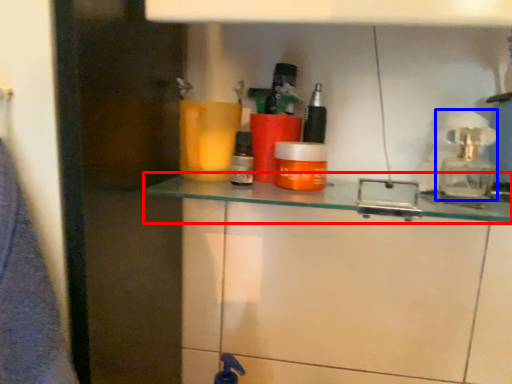
Question: Which point is further to the camera, shelf (highlighted by a red box) or soap dispenser (highlighted by a blue box)?

Choices:
 (A) shelf
 (B) soap dispenser

Answer: (B)